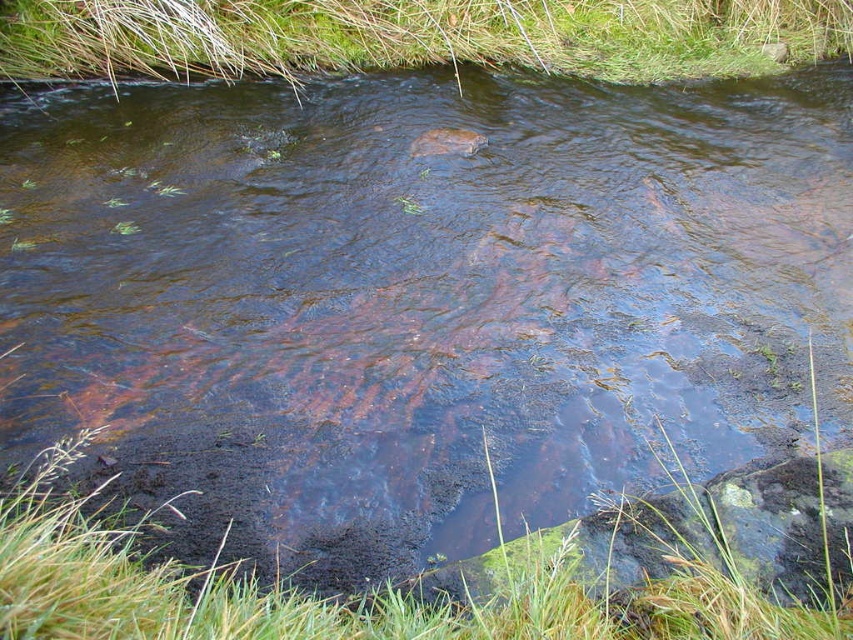
Question: Can you confirm if green grass at lower left is bigger than green algae at upper center?

Choices:
 (A) yes
 (B) no

Answer: (A)

Question: Which of the following is the closest to the observer?

Choices:
 (A) green algae at upper center
 (B) green grass at lower left

Answer: (B)

Question: Is green grass at lower left below green algae at upper center?

Choices:
 (A) no
 (B) yes

Answer: (B)

Question: Can you confirm if green grass at lower left is smaller than green algae at upper center?

Choices:
 (A) yes
 (B) no

Answer: (B)

Question: Which point is farther from the camera taking this photo?

Choices:
 (A) (49, 486)
 (B) (809, 38)

Answer: (B)